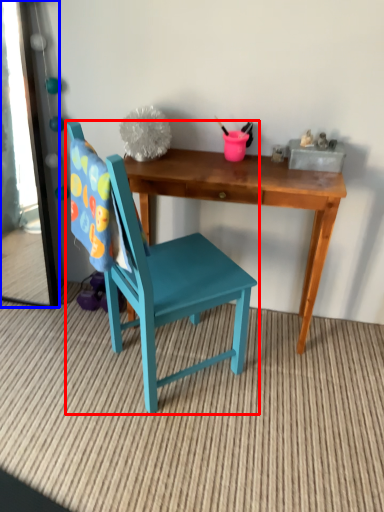
Question: Which object appears closest to the camera in this image, chair (highlighted by a red box) or mirror (highlighted by a blue box)?

Choices:
 (A) chair
 (B) mirror

Answer: (A)